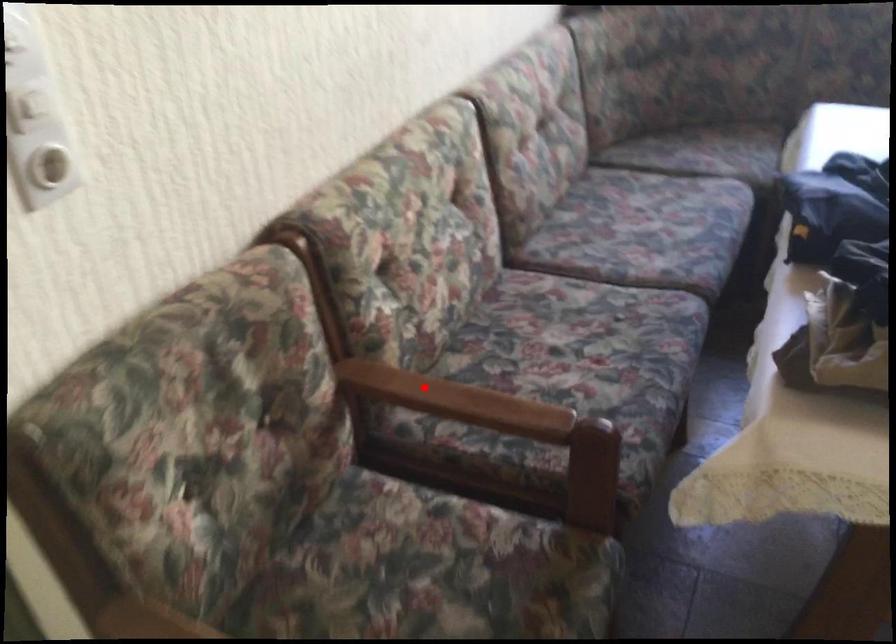
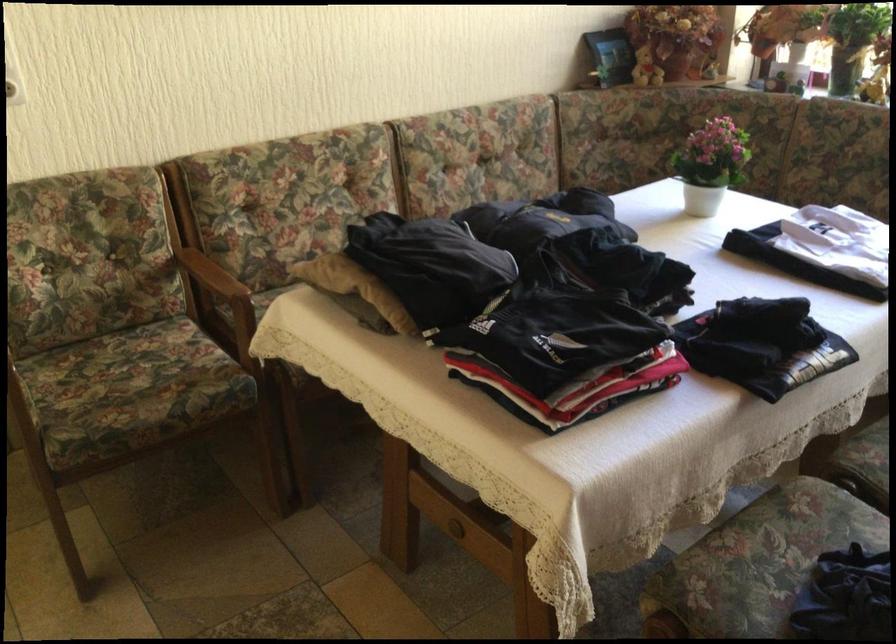
Question: I am providing you with two images of the same scene from different viewpoints. A red point is shown in image1. For the corresponding object point in image2, is it positioned nearer or farther from the camera?

Choices:
 (A) Nearer
 (B) Farther

Answer: (B)